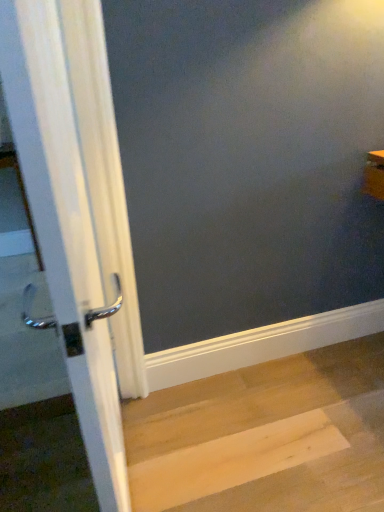
Where is `vacant region to the right of white glossy door handle at left`? vacant region to the right of white glossy door handle at left is located at coordinates (244, 454).